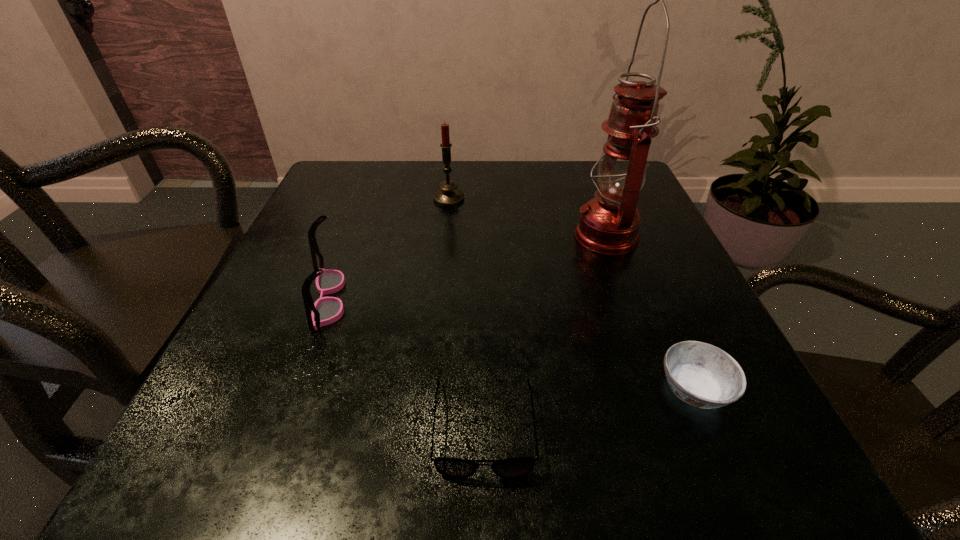
Identify the location of vacant space located 0.180m on the right of the second tallest object. (545, 199).

This screenshot has height=540, width=960. I want to click on vacant space positioned 0.220m on the back of the third farthest object, so click(362, 206).

Where is `free location located 0.330m on the left of the ashtray`? free location located 0.330m on the left of the ashtray is located at coordinates (417, 390).

Find the location of a particular element. The image size is (960, 540). oil lamp situated at the far edge is located at coordinates (609, 223).

Identify the location of candle situated at the far edge. The width and height of the screenshot is (960, 540). (448, 196).

Image resolution: width=960 pixels, height=540 pixels. What are the coordinates of `ashtray situated at the near edge` in the screenshot? It's located at (700, 374).

At what (x,y) coordinates should I click in order to perform the action: click on spectacles present at the near edge. Please return your answer as a coordinate pair (x, y). Looking at the image, I should click on (455, 468).

Image resolution: width=960 pixels, height=540 pixels. I want to click on object that is at the left edge, so click(326, 310).

This screenshot has width=960, height=540. What are the coordinates of `oil lamp that is positioned at the right edge` in the screenshot? It's located at (609, 223).

At what (x,y) coordinates should I click in order to perform the action: click on ashtray situated at the right edge. Please return your answer as a coordinate pair (x, y). Image resolution: width=960 pixels, height=540 pixels. Looking at the image, I should click on (700, 374).